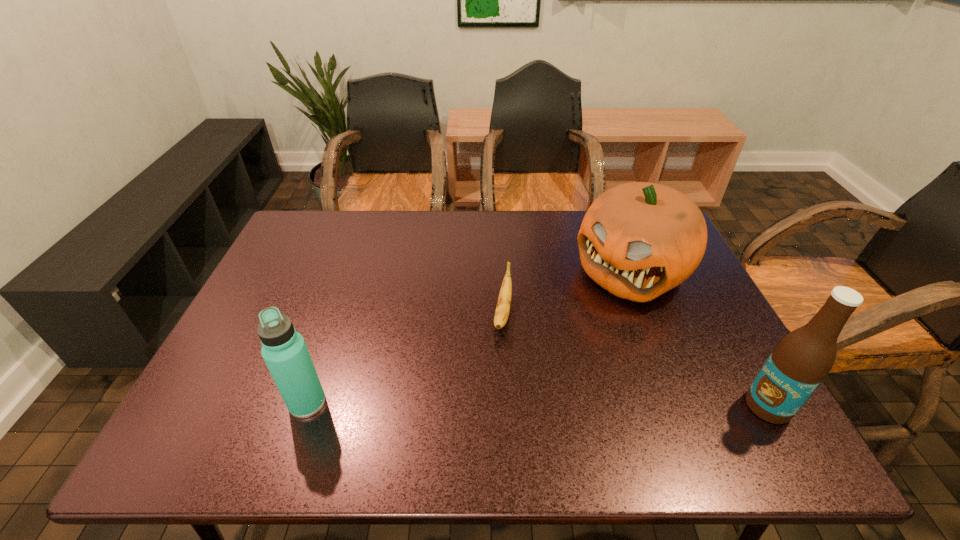
Where is `free space between the shortest object and the leftmost object`? This screenshot has width=960, height=540. free space between the shortest object and the leftmost object is located at coordinates (405, 358).

Image resolution: width=960 pixels, height=540 pixels. I want to click on free space between the pumpkin and the banana, so click(566, 293).

Where is `unoccupied position between the shortest object and the pumpkin`? unoccupied position between the shortest object and the pumpkin is located at coordinates (566, 293).

Find the location of a particular element. The width and height of the screenshot is (960, 540). blank region between the third object from right to left and the beer bottle is located at coordinates (636, 360).

Image resolution: width=960 pixels, height=540 pixels. I want to click on vacant space that's between the pumpkin and the third object from right to left, so click(x=566, y=293).

The image size is (960, 540). I want to click on free area in between the thermos bottle and the beer bottle, so click(538, 404).

Point out which object is positioned as the nearest to the banana. Please provide its 2D coordinates. Your answer should be formatted as a tuple, i.e. [(x, y)], where the tuple contains the x and y coordinates of a point satisfying the conditions above.

[(638, 240)]

Image resolution: width=960 pixels, height=540 pixels. Identify the location of object that is the third closest to the thermos bottle. (799, 363).

The image size is (960, 540). I want to click on free space that satisfies the following two spatial constraints: 1. on the back side of the banana; 2. on the right side of the thermos bottle, so click(x=337, y=314).